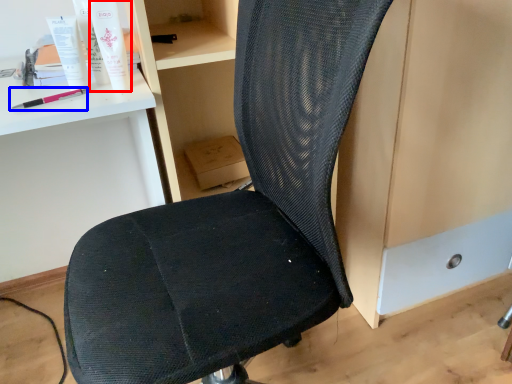
Question: Which of the following is the farthest to the observer, toiletry (highlighted by a red box) or equipment (highlighted by a blue box)?

Choices:
 (A) toiletry
 (B) equipment

Answer: (B)